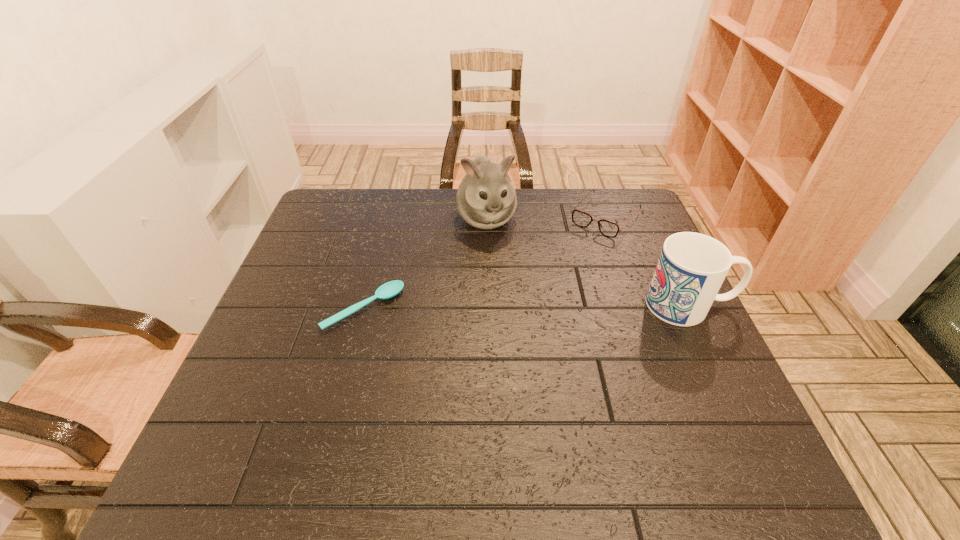
Identify the location of free space that satisfies the following two spatial constraints: 1. on the back side of the shortest object; 2. on the right side of the mug. (365, 305).